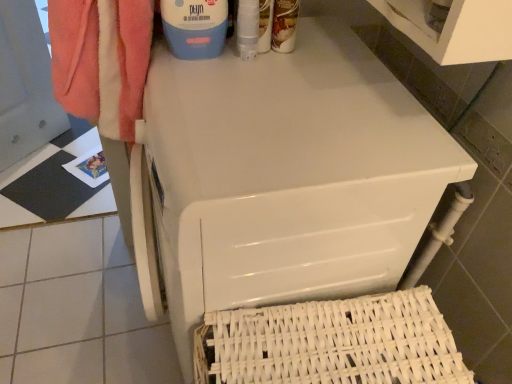
The image size is (512, 384). Find the location of `free spot above white glossy washing machine at upper center (from a real-world perspective)`. free spot above white glossy washing machine at upper center (from a real-world perspective) is located at coordinates (276, 84).